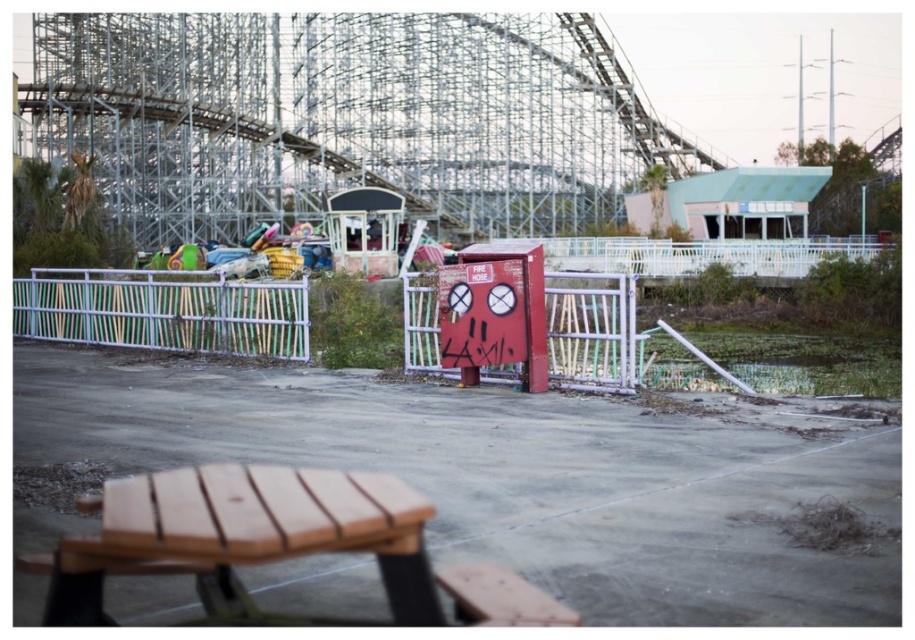
Question: Is red painted metal fire hose cabinet at center closer to the viewer compared to wooden picnic table at lower center?

Choices:
 (A) yes
 (B) no

Answer: (B)

Question: Does red painted metal fire hose cabinet at center have a lesser width compared to rusty metal gate at center?

Choices:
 (A) yes
 (B) no

Answer: (B)

Question: Considering the relative positions of red painted metal fire hose cabinet at center and rusty metal fire hose box at center in the image provided, where is red painted metal fire hose cabinet at center located with respect to rusty metal fire hose box at center?

Choices:
 (A) left
 (B) right

Answer: (A)

Question: Estimate the real-world distances between objects in this image. Which object is farther from the white painted wood fence at left?

Choices:
 (A) rusty metal fire hose box at center
 (B) wooden picnic table at lower center

Answer: (B)

Question: Which of the following is the farthest from the observer?

Choices:
 (A) rusty metal gate at center
 (B) wooden picnic table at lower center
 (C) rusty metal fire hose box at center
 (D) white painted wood fence at left

Answer: (D)

Question: Which point is closer to the camera taking this photo?

Choices:
 (A) (492, 321)
 (B) (824, 289)

Answer: (A)